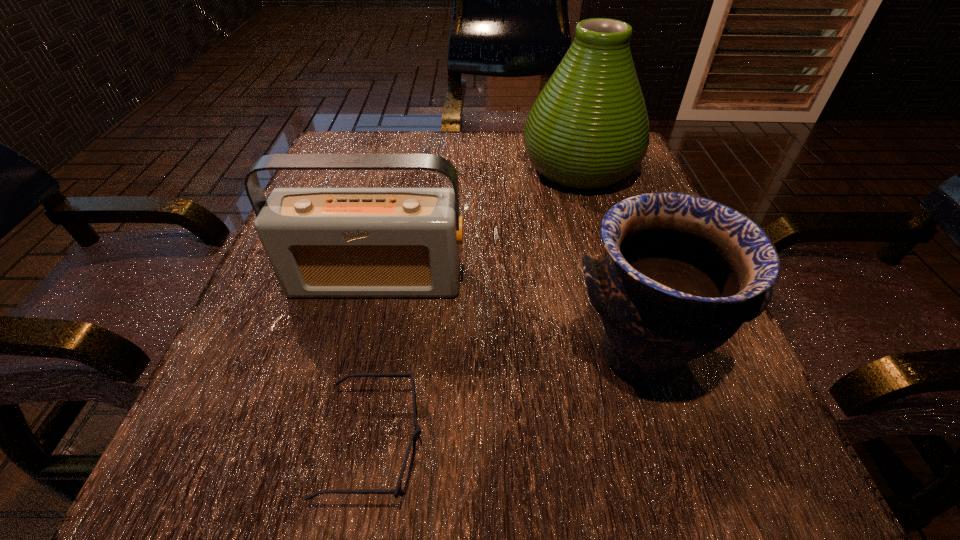
What are the coordinates of `object at the left edge` in the screenshot? It's located at (321, 242).

Identify the location of vase present at the right edge. The image size is (960, 540). (588, 129).

Find the location of a particular element. The height and width of the screenshot is (540, 960). pottery that is at the right edge is located at coordinates (681, 273).

Identify the location of object positioned at the far right corner. This screenshot has width=960, height=540. (588, 129).

Locate an element on the screen. The height and width of the screenshot is (540, 960). vacant space at the far edge of the desktop is located at coordinates (473, 141).

This screenshot has height=540, width=960. In order to click on vacant space at the near edge of the desktop in this screenshot , I will do `click(405, 507)`.

In the image, there is a desktop. Where is `free space at the left edge`? This screenshot has width=960, height=540. free space at the left edge is located at coordinates (303, 315).

Identify the location of vacant area at the right edge of the desktop. (724, 420).

The width and height of the screenshot is (960, 540). I want to click on vacant space at the far left corner of the desktop, so click(350, 174).

Identify the location of vacant space that's between the spectacles and the pottery. This screenshot has height=540, width=960. (507, 398).